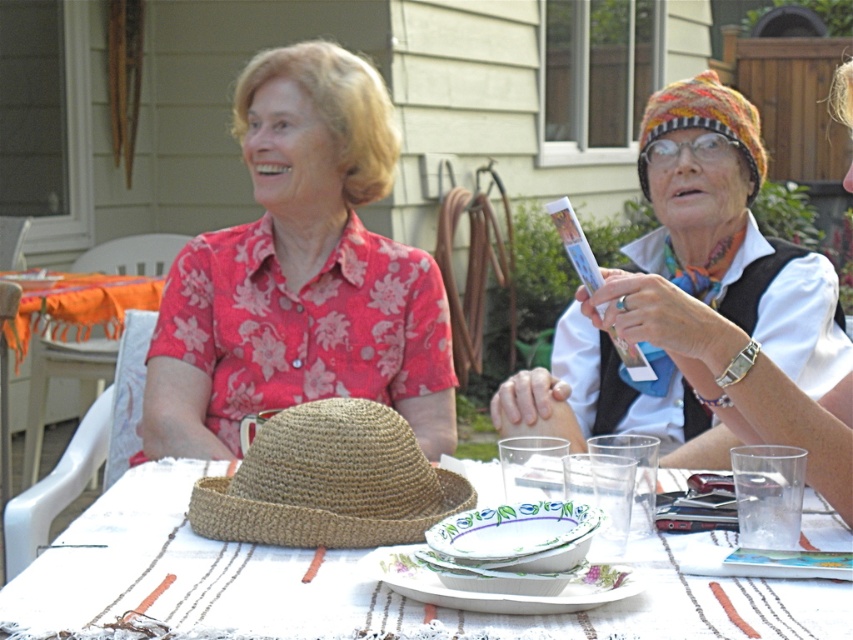
Question: Does knitted woolen hat at upper right appear over brown woven straw hat at center?

Choices:
 (A) yes
 (B) no

Answer: (A)

Question: Which of these objects is positioned farthest from the braided straw hat at center?

Choices:
 (A) white plastic picnic table at lower left
 (B) knitted woolen hat at upper right
 (C) floral cotton shirt at center
 (D) brown woven straw hat at center

Answer: (A)

Question: Is braided straw hat at center positioned at the back of brown woven straw hat at center?

Choices:
 (A) yes
 (B) no

Answer: (B)

Question: Which point appears closest to the camera in this image?

Choices:
 (A) (227, 387)
 (B) (424, 518)

Answer: (B)

Question: Considering the relative positions of floral cotton shirt at center and knitted woolen hat at upper right in the image provided, where is floral cotton shirt at center located with respect to knitted woolen hat at upper right?

Choices:
 (A) left
 (B) right

Answer: (A)

Question: Which object is closer to the camera taking this photo?

Choices:
 (A) floral cotton shirt at center
 (B) knitted woolen hat at upper right

Answer: (B)